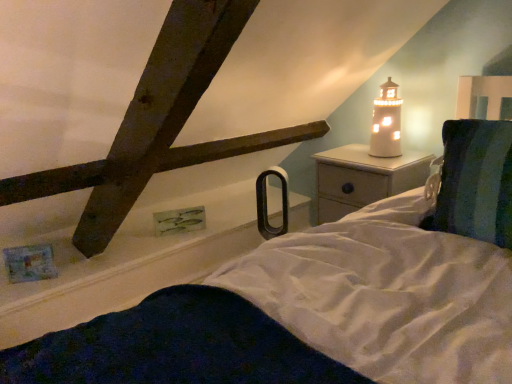
In order to face white ceramic lighthouse at upper right, should I rotate leftwards or rightwards?

It's best to rotate right around 17.068 degrees.

Describe the element at coordinates (386, 123) in the screenshot. I see `white ceramic lighthouse at upper right` at that location.

You are a GUI agent. You are given a task and a screenshot of the screen. Output one action in this format:
    pyautogui.click(x=<x>, y=<y>)
    Task: Click on the white ceramic lighthouse at upper right
    
    Given the screenshot: What is the action you would take?
    pyautogui.click(x=386, y=123)

Measure the distance between white ceramic lighthouse at upper right and camera.

white ceramic lighthouse at upper right and camera are 1.82 meters apart from each other.

Image resolution: width=512 pixels, height=384 pixels. Find the location of `white ceramic lighthouse at upper right`. white ceramic lighthouse at upper right is located at coordinates (386, 123).